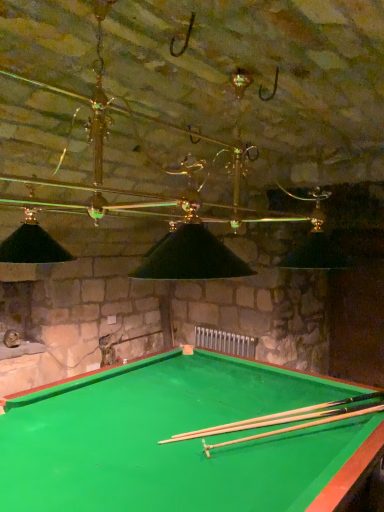
Question: Should I look upward or downward to see wooden cue at center?

Choices:
 (A) down
 (B) up

Answer: (A)